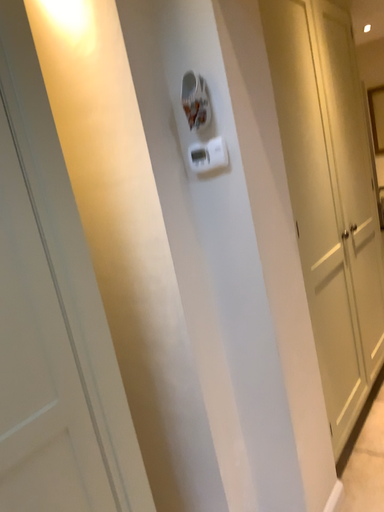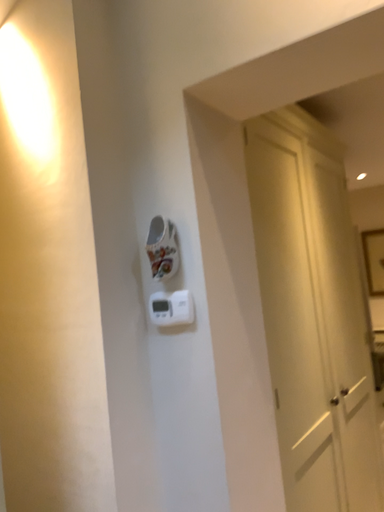
Question: Which way did the camera rotate in the video?

Choices:
 (A) rotated upward
 (B) rotated downward

Answer: (A)